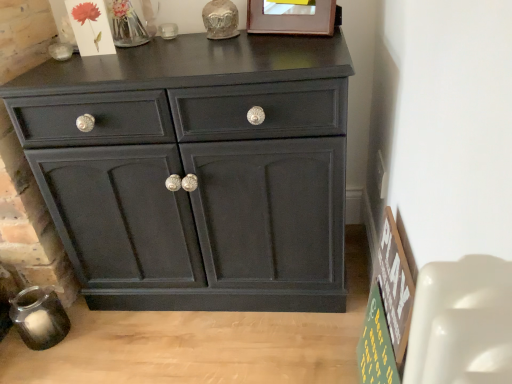
Find the location of a particular element. The image size is (512, 384). vacant space to the left of wooden picture frame at upper center is located at coordinates (236, 44).